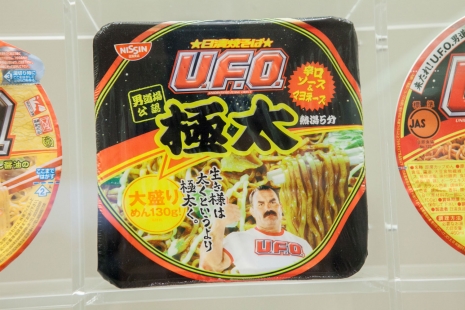
I want to click on tan tile, so click(x=427, y=282).